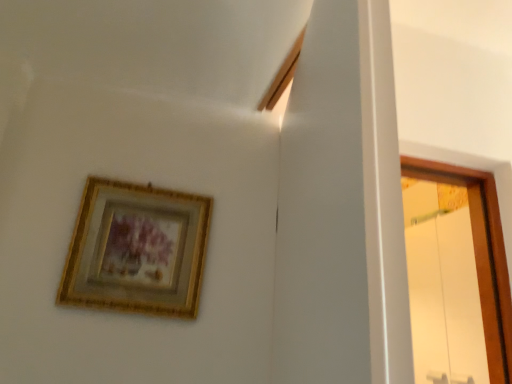
Question: Should I look upward or downward to see gold/gilded picture frame at upper left?

Choices:
 (A) up
 (B) down

Answer: (B)